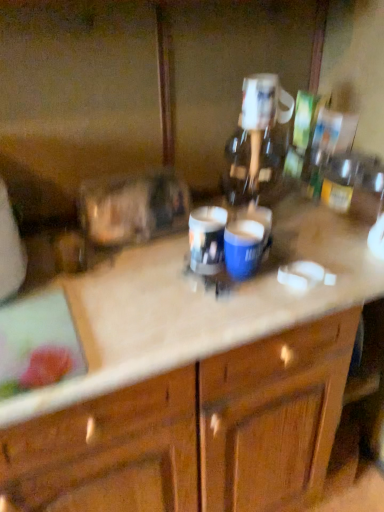
Image resolution: width=384 pixels, height=512 pixels. Find the location of `free point to the right of blue glossy mug at center, the 2th beverage from the left`. free point to the right of blue glossy mug at center, the 2th beverage from the left is located at coordinates point(325,267).